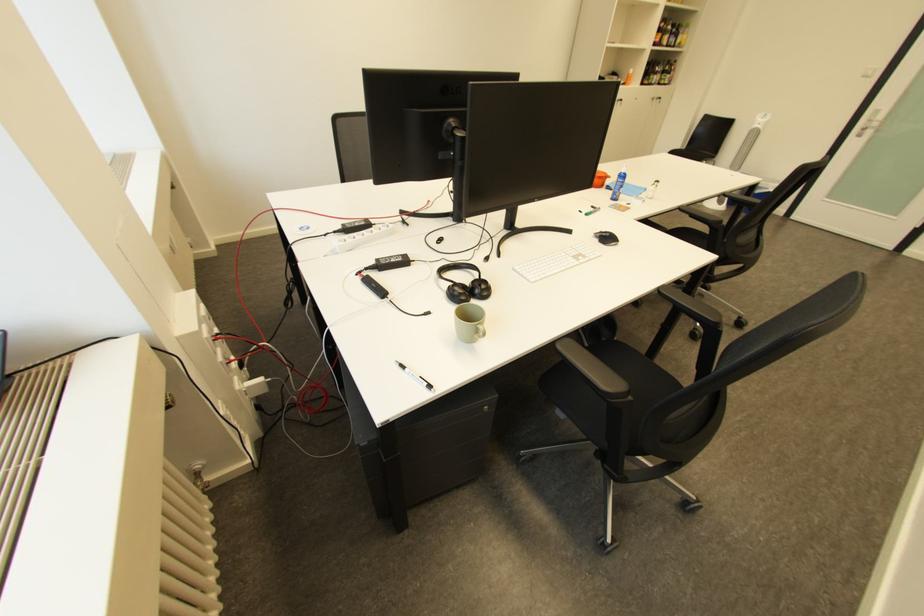
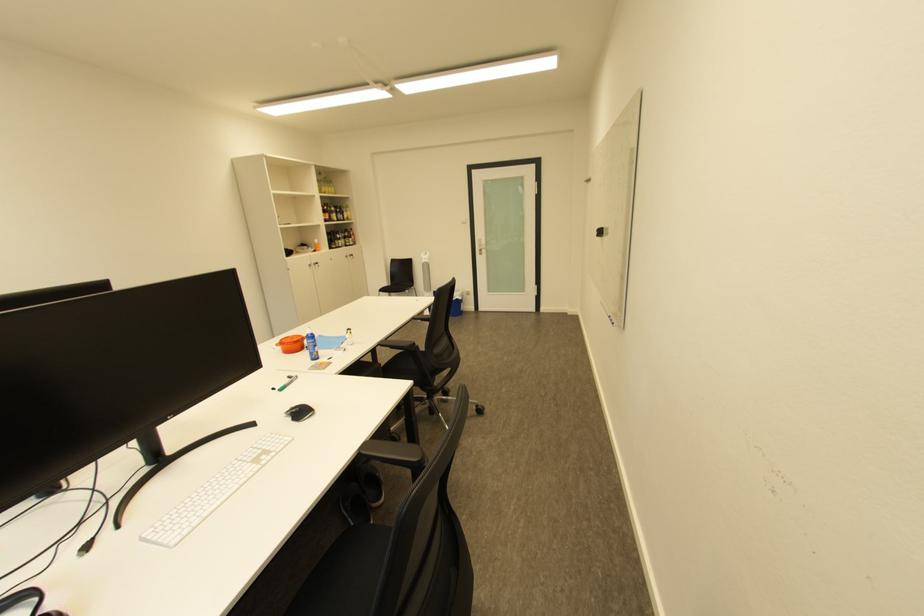
The point at [611,187] is marked in the first image. Where is the corresponding point in the second image?

(311, 350)